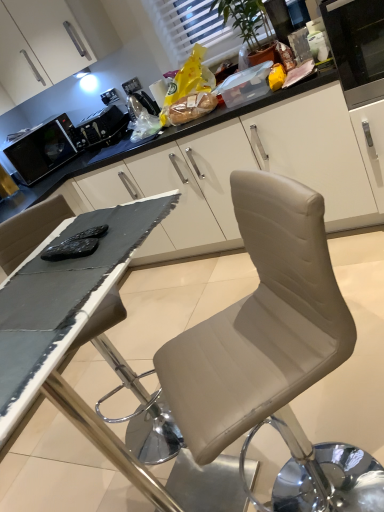
Find the location of a particular element. The width and height of the screenshot is (384, 512). vacant space situated above beige leather chair at center (from a real-world perspective) is located at coordinates (163, 336).